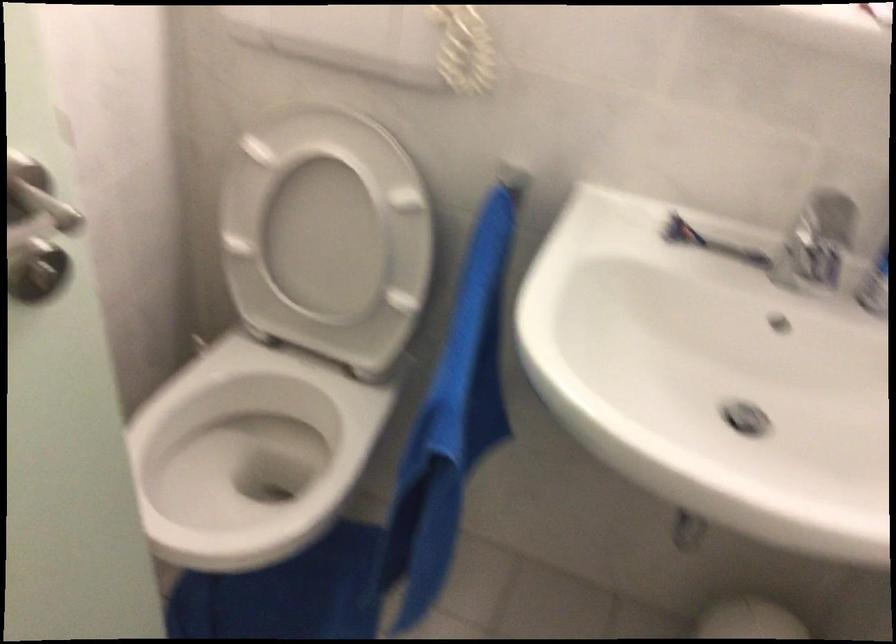
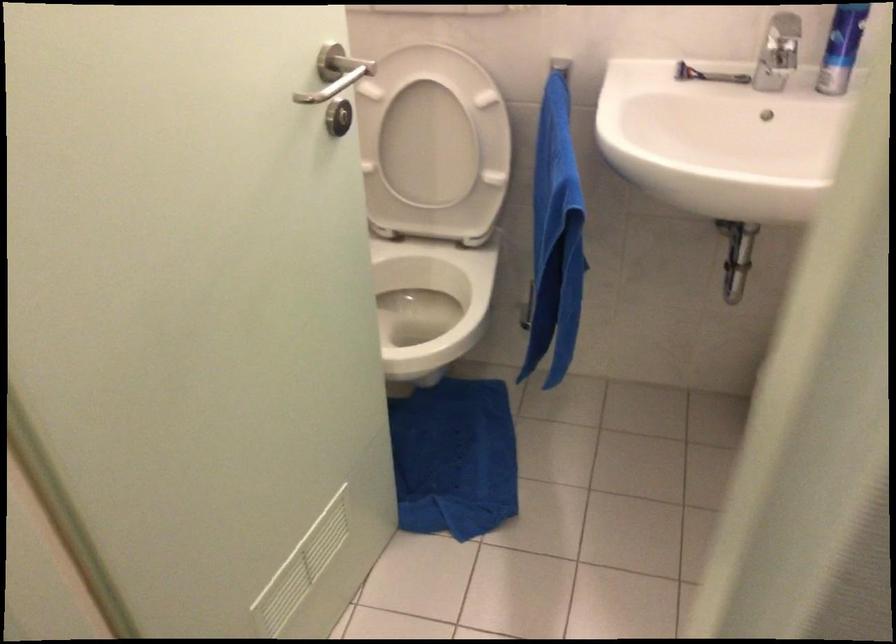
Find the pixel in the second image that matches (x=324, y=247) in the first image.

(424, 149)